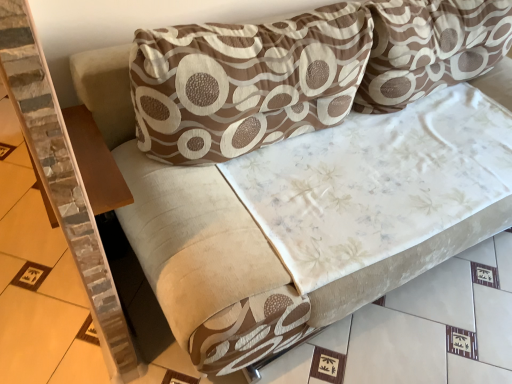
Question: Could you tell me if brown wood table at left is turned towards brown printed cushion at upper center, positioned as the 1th pillow in left-to-right order?

Choices:
 (A) no
 (B) yes

Answer: (B)

Question: Is brown wood table at left to the left of brown printed cushion at upper center, arranged as the 2th pillow when viewed from the right, from the viewer's perspective?

Choices:
 (A) no
 (B) yes

Answer: (B)

Question: Can you confirm if brown wood table at left is positioned to the right of brown printed cushion at upper center, arranged as the 2th pillow when viewed from the right?

Choices:
 (A) yes
 (B) no

Answer: (B)

Question: Considering the relative sizes of brown wood table at left and brown printed cushion at upper center, arranged as the 2th pillow when viewed from the right, in the image provided, is brown wood table at left thinner than brown printed cushion at upper center, arranged as the 2th pillow when viewed from the right,?

Choices:
 (A) yes
 (B) no

Answer: (A)

Question: Is brown wood table at left taller than brown printed cushion at upper center, positioned as the 1th pillow in left-to-right order?

Choices:
 (A) no
 (B) yes

Answer: (A)

Question: Is brown wood table at left wider than brown printed cushion at upper center, arranged as the 2th pillow when viewed from the right?

Choices:
 (A) no
 (B) yes

Answer: (A)

Question: From the image's perspective, is brown printed fabric pillow at upper center, the first pillow viewed from the right, below brown printed cushion at upper center, arranged as the 2th pillow when viewed from the right?

Choices:
 (A) no
 (B) yes

Answer: (A)

Question: Does brown printed fabric pillow at upper center, the first pillow viewed from the right, have a lesser width compared to brown printed cushion at upper center, positioned as the 1th pillow in left-to-right order?

Choices:
 (A) yes
 (B) no

Answer: (B)

Question: From a real-world perspective, is brown printed fabric pillow at upper center, the first pillow viewed from the right, physically above brown printed cushion at upper center, positioned as the 1th pillow in left-to-right order?

Choices:
 (A) yes
 (B) no

Answer: (A)

Question: Is brown printed fabric pillow at upper center, positioned as the second pillow in left-to-right order, facing away from brown printed cushion at upper center, arranged as the 2th pillow when viewed from the right?

Choices:
 (A) yes
 (B) no

Answer: (B)

Question: Is brown printed fabric pillow at upper center, the first pillow viewed from the right, wider than brown printed cushion at upper center, arranged as the 2th pillow when viewed from the right?

Choices:
 (A) no
 (B) yes

Answer: (B)

Question: From the image's perspective, is brown printed fabric pillow at upper center, the first pillow viewed from the right, over brown printed cushion at upper center, arranged as the 2th pillow when viewed from the right?

Choices:
 (A) no
 (B) yes

Answer: (B)

Question: Is brown wood table at left shorter than brown printed fabric pillow at upper center, the first pillow viewed from the right?

Choices:
 (A) no
 (B) yes

Answer: (B)